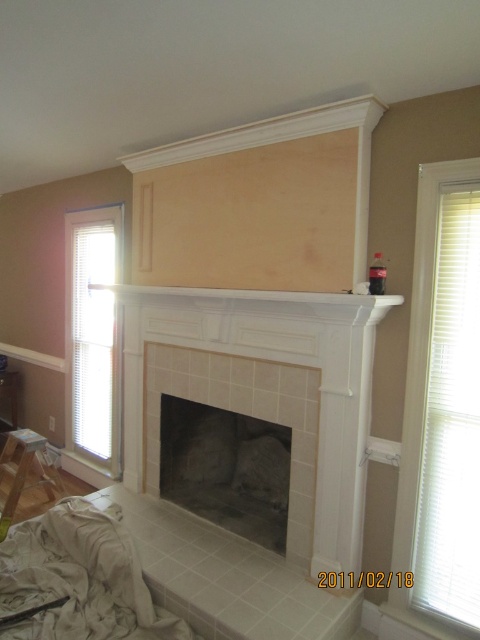
You are standing in the room and want to know which object occupies more space in the image between the white tile fireplace at center and the white blinds at right. Based on their sizes, which one is bigger?

The white tile fireplace at center is larger in size than the white blinds at right, so the white tile fireplace at center occupies more space in the image.

You are standing in the room and want to move from the white blinds at left to the gray stone fireplace at center. Which direction should you move in?

You should move to the right to reach the gray stone fireplace at center from the white blinds at left since it is positioned to the right of the white blinds at left.